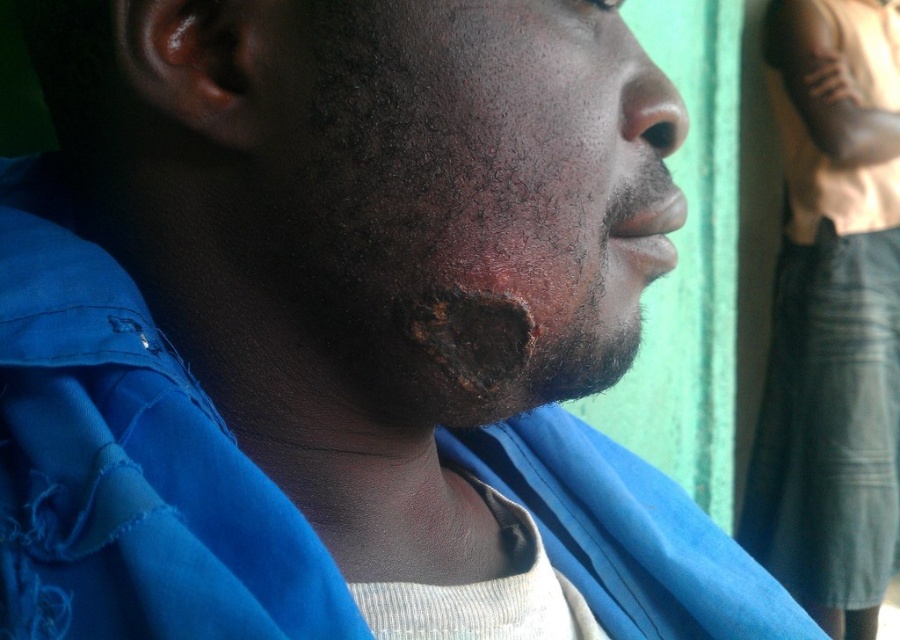
Based on the scene description, which object takes up more area in the image between the dry skin at center and the dark blue fabric at center?

The dark blue fabric at center occupies more space than the dry skin at center in the image.

You are a photographer adjusting your camera settings. You notice two points in the image at coordinates point (505, 240) and point (777, 454). Which point should you focus on to ensure it appears sharp in the final photo if you want the closer object to be in focus?

You should focus on point (505, 240) because it is closer to the camera than point (777, 454), so focusing on the closer point will ensure it appears sharp.

You are an interior designer assessing the placement of two decorative lights in a room. The first light is at point (x=644, y=196) and the second is at point (x=642, y=81). From the perspective of someone standing in the center of the room facing the green wall, which light is closer to the wall?

Point (x=644, y=196) is behind point (x=642, y=81), so the light at point (x=644, y=196) is closer to the green wall.